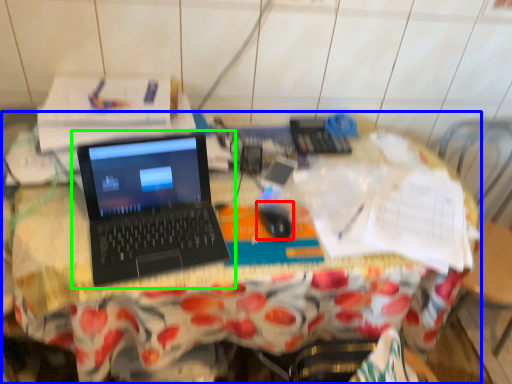
Question: Which object is the farthest from mouse (highlighted by a red box)? Choose among these: desk (highlighted by a blue box) or laptop (highlighted by a green box).

Choices:
 (A) desk
 (B) laptop

Answer: (A)